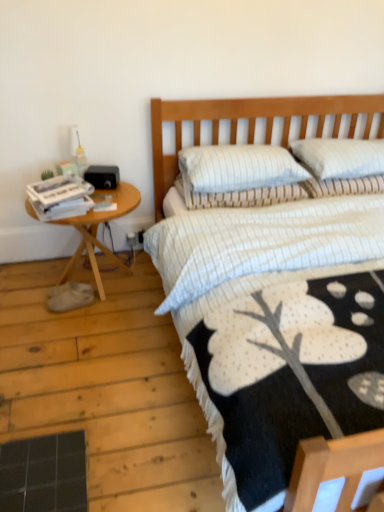
Question: From a real-world perspective, is woodenwoodenside table at left over white striped pillow at upper right, which appears as the 3th pillow when viewed from the left?

Choices:
 (A) no
 (B) yes

Answer: (A)

Question: From the image's perspective, does woodenwoodenside table at left appear higher than white striped pillow at upper right, which appears as the 3th pillow when viewed from the left?

Choices:
 (A) yes
 (B) no

Answer: (B)

Question: Is woodenwoodenside table at left thinner than white striped pillow at upper right, which is the first pillow in right-to-left order?

Choices:
 (A) no
 (B) yes

Answer: (A)

Question: Is woodenwoodenside table at left in front of white striped pillow at upper right, which appears as the 3th pillow when viewed from the left?

Choices:
 (A) no
 (B) yes

Answer: (B)

Question: Is woodenwoodenside table at left outside of white striped pillow at upper right, which is the first pillow in right-to-left order?

Choices:
 (A) no
 (B) yes

Answer: (B)

Question: Is the surface of woodenwoodenside table at left in direct contact with white striped pillow at upper right, which is the first pillow in right-to-left order?

Choices:
 (A) no
 (B) yes

Answer: (A)

Question: Can you confirm if woodenwoodenside table at left is smaller than white paper magazines at left?

Choices:
 (A) yes
 (B) no

Answer: (B)

Question: From a real-world perspective, is woodenwoodenside table at left physically below white paper magazines at left?

Choices:
 (A) no
 (B) yes

Answer: (B)

Question: Is woodenwoodenside table at left bigger than white paper magazines at left?

Choices:
 (A) no
 (B) yes

Answer: (B)

Question: Is woodenwoodenside table at left not close to white paper magazines at left?

Choices:
 (A) yes
 (B) no

Answer: (B)

Question: Does woodenwoodenside table at left turn towards white paper magazines at left?

Choices:
 (A) no
 (B) yes

Answer: (A)

Question: Considering the relative positions of woodenwoodenside table at left and white paper magazines at left in the image provided, is woodenwoodenside table at left to the left of white paper magazines at left from the viewer's perspective?

Choices:
 (A) yes
 (B) no

Answer: (B)

Question: Is white paper magazines at left behind white striped pillow at upper right, which appears as the 3th pillow when viewed from the left?

Choices:
 (A) yes
 (B) no

Answer: (B)